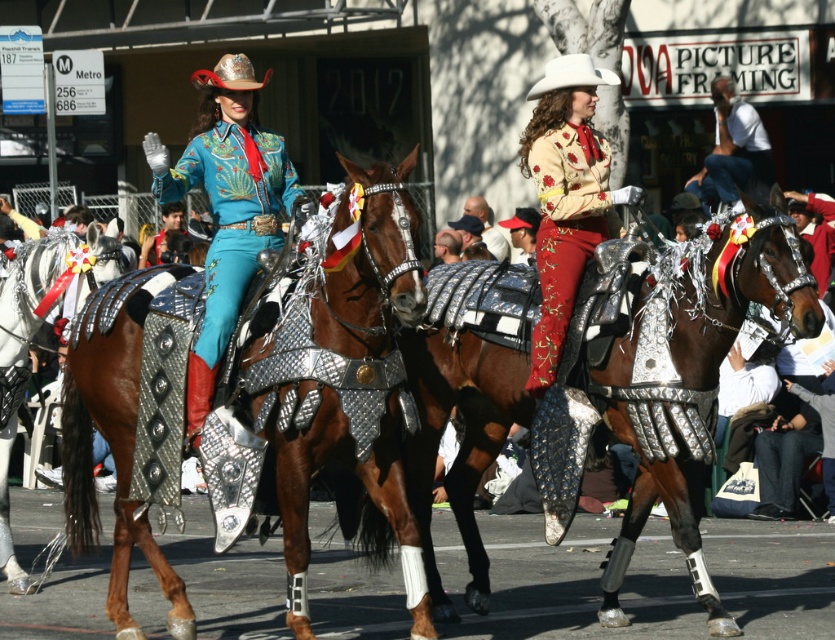
Question: In this image, where is shiny brown horse at center located relative to white cotton shirt at upper right?

Choices:
 (A) below
 (B) above

Answer: (A)

Question: Among these points, which one is farthest from the camera?

Choices:
 (A) (719, 236)
 (B) (231, 122)
 (C) (540, 230)
 (D) (721, 118)

Answer: (D)

Question: Does shiny silver armor at center appear under matte teal fabric at center?

Choices:
 (A) yes
 (B) no

Answer: (A)

Question: Which of the following is the closest to the observer?

Choices:
 (A) (0, 285)
 (B) (104, 410)

Answer: (B)

Question: Estimate the real-world distances between objects in this image. Which object is farther from the shiny brown horse at center?

Choices:
 (A) matte teal fabric at center
 (B) shiny silver armor at center
 (C) white matte cowboy hat at upper center
 (D) embroidered velvet pants at center

Answer: (C)

Question: Can you confirm if shiny silver armor at center is smaller than embroidered velvet pants at center?

Choices:
 (A) yes
 (B) no

Answer: (B)